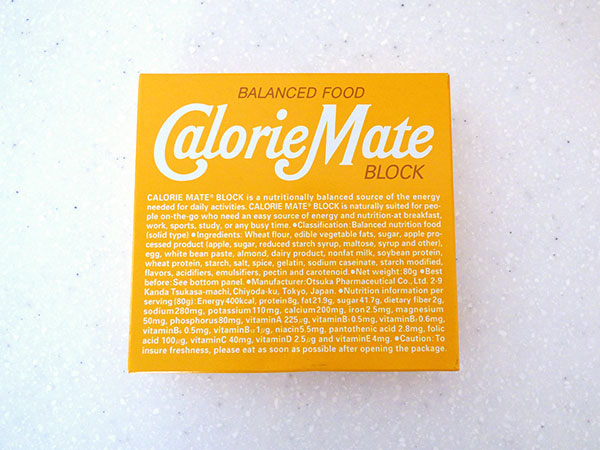
What are the coordinates of `box` in the screenshot? It's located at [141, 75], [132, 369], [455, 368], [445, 76].